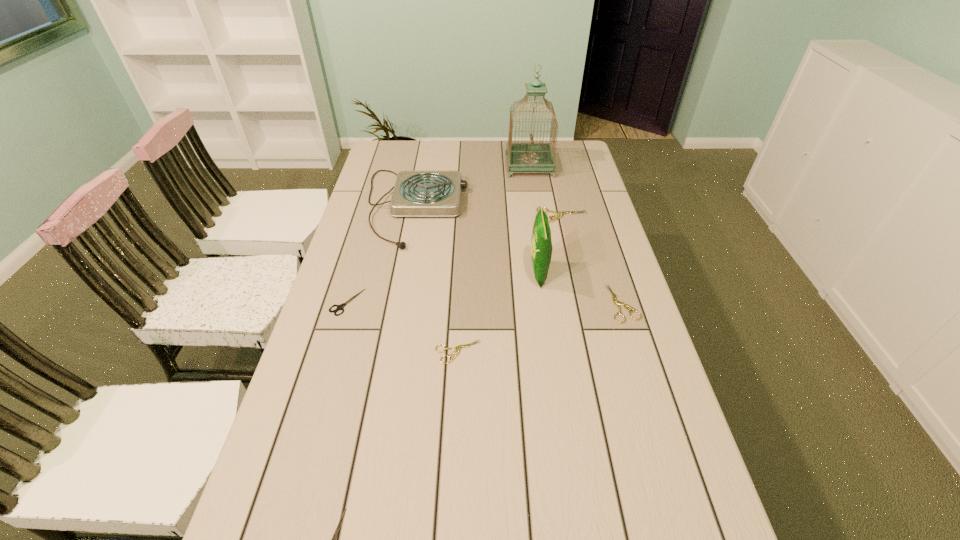
Find the location of `free space located 0.120m on the back of the left black shears`. free space located 0.120m on the back of the left black shears is located at coordinates (359, 262).

You are a GUI agent. You are given a task and a screenshot of the screen. Output one action in this format:
    pyautogui.click(x=<x>, y=<y>)
    Task: Click on the vacant space located on the left of the second nearest beige shears
    
    Given the screenshot: What is the action you would take?
    pyautogui.click(x=533, y=303)

Identify the location of vacant space located 0.120m on the front of the leftmost beige shears. (456, 408).

Where is `object located at the far edge`? The image size is (960, 540). object located at the far edge is located at coordinates (531, 157).

This screenshot has height=540, width=960. What are the coordinates of `hotplate that is at the left edge` in the screenshot? It's located at (416, 193).

Identify the location of shears that is positioned at the left edge. (339, 307).

Locate an element on the screen. The height and width of the screenshot is (540, 960). birdcage that is at the right edge is located at coordinates (531, 157).

The height and width of the screenshot is (540, 960). Identify the location of object that is at the far right corner. (531, 157).

In the image, there is a desktop. Where is `vacant space at the far edge`? vacant space at the far edge is located at coordinates pos(434,140).

This screenshot has height=540, width=960. Find the location of `free space at the left edge of the desktop`. free space at the left edge of the desktop is located at coordinates (329, 389).